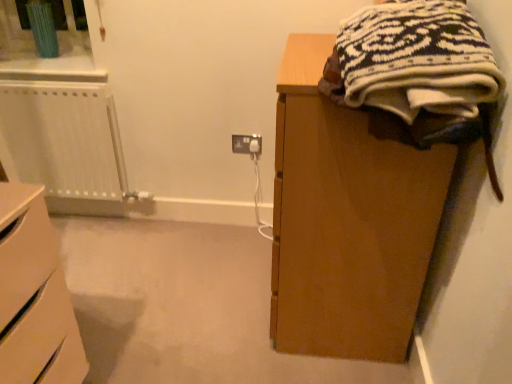
Question: Is knitted wool sweater at upper right turned away from white plastic radiator at left?

Choices:
 (A) no
 (B) yes

Answer: (A)

Question: Is knitted wool sweater at upper right positioned behind white plastic radiator at left?

Choices:
 (A) yes
 (B) no

Answer: (B)

Question: Considering the relative positions of knitted wool sweater at upper right and white plastic radiator at left in the image provided, is knitted wool sweater at upper right to the right of white plastic radiator at left from the viewer's perspective?

Choices:
 (A) yes
 (B) no

Answer: (A)

Question: Is knitted wool sweater at upper right bigger than white plastic radiator at left?

Choices:
 (A) yes
 (B) no

Answer: (A)

Question: From a real-world perspective, is knitted wool sweater at upper right located higher than white plastic radiator at left?

Choices:
 (A) yes
 (B) no

Answer: (A)

Question: Considering the positions of white plastic radiator at left and matte white socket at center in the image, is white plastic radiator at left bigger or smaller than matte white socket at center?

Choices:
 (A) big
 (B) small

Answer: (A)

Question: Which is correct: white plastic radiator at left is inside matte white socket at center, or outside of it?

Choices:
 (A) outside
 (B) inside

Answer: (A)

Question: From the image's perspective, is white plastic radiator at left above or below matte white socket at center?

Choices:
 (A) above
 (B) below

Answer: (A)

Question: Is white plastic radiator at left taller or shorter than matte white socket at center?

Choices:
 (A) short
 (B) tall

Answer: (B)

Question: Would you say white plastic radiator at left is to the left or to the right of knitted wool sweater at upper right in the picture?

Choices:
 (A) left
 (B) right

Answer: (A)

Question: Relative to knitted wool sweater at upper right, is white plastic radiator at left in front or behind?

Choices:
 (A) front
 (B) behind

Answer: (B)

Question: From the image's perspective, is white plastic radiator at left positioned above or below knitted wool sweater at upper right?

Choices:
 (A) above
 (B) below

Answer: (B)

Question: Looking at the image, does white plastic radiator at left seem bigger or smaller compared to knitted wool sweater at upper right?

Choices:
 (A) big
 (B) small

Answer: (B)

Question: From the image's perspective, is matte white socket at center located above or below white matte chest of drawers at lower left?

Choices:
 (A) below
 (B) above

Answer: (B)

Question: Is matte white socket at center in front of or behind white matte chest of drawers at lower left in the image?

Choices:
 (A) behind
 (B) front

Answer: (A)